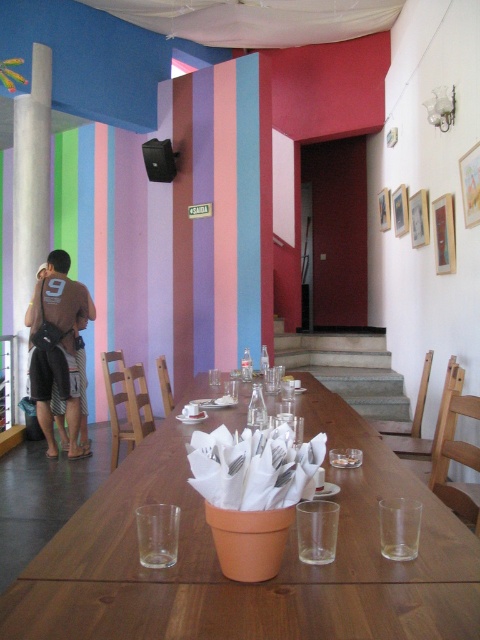
Which is behind, point (383, 561) or point (62, 358)?

Positioned behind is point (62, 358).

Where is `wooden table at center`? This screenshot has width=480, height=640. wooden table at center is located at coordinates (245, 582).